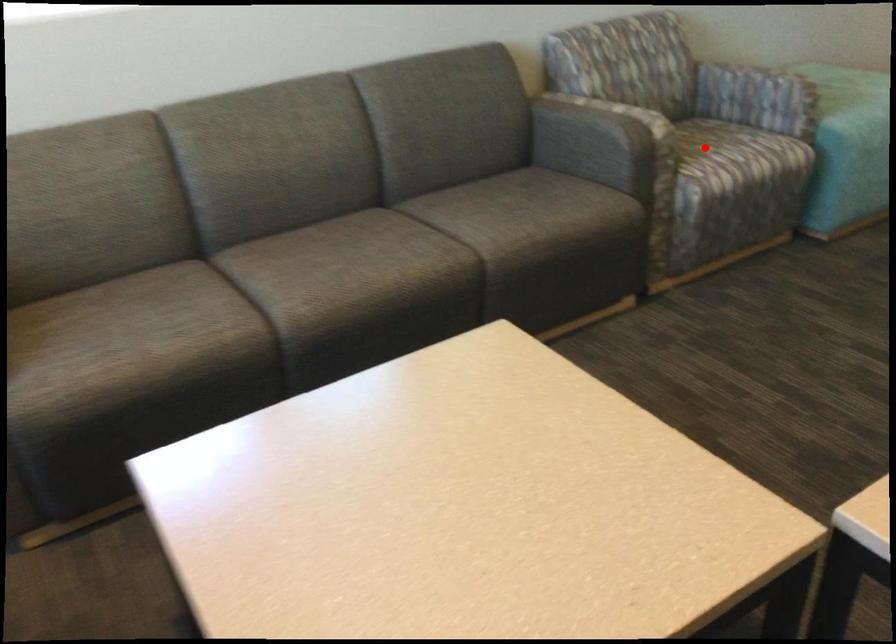
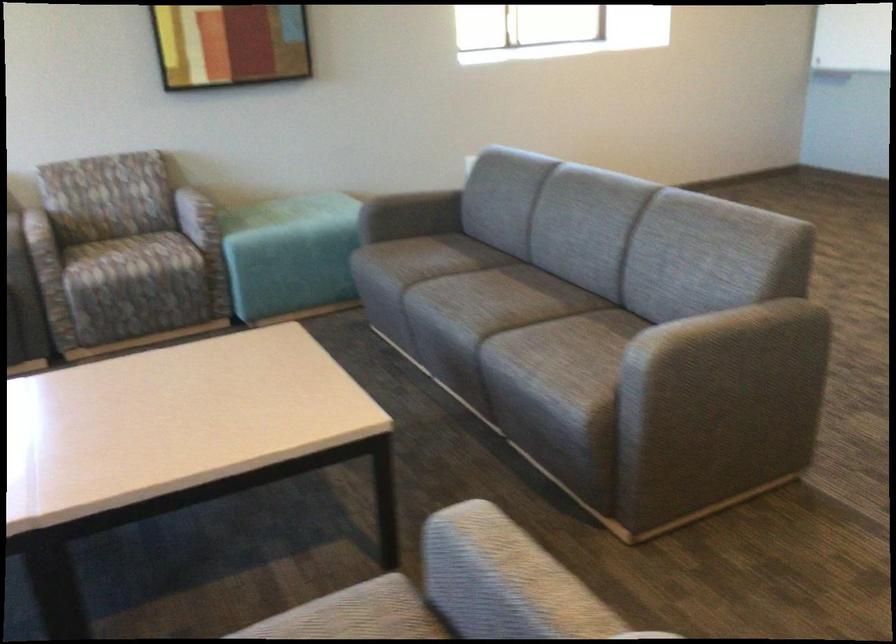
Question: I am providing you with two images of the same scene from different viewpoints. A red point is shown in image1. For the corresponding object point in image2, is it positioned nearer or farther from the camera?

Choices:
 (A) Nearer
 (B) Farther

Answer: (B)